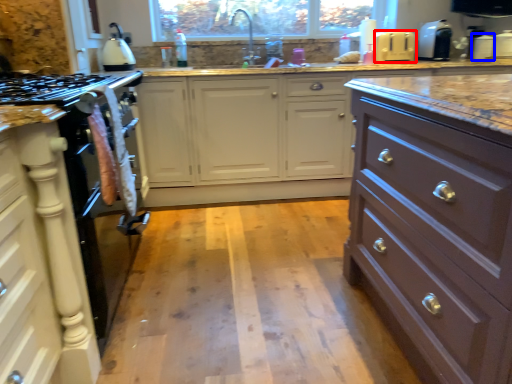
Question: Which object appears closest to the camera in this image, appliance (highlighted by a red box) or appliance (highlighted by a blue box)?

Choices:
 (A) appliance
 (B) appliance

Answer: (A)